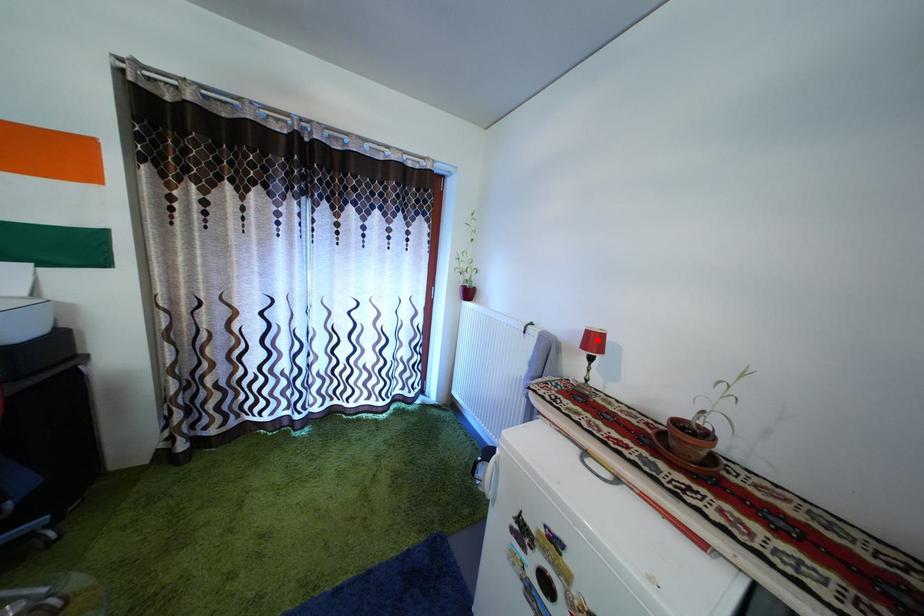
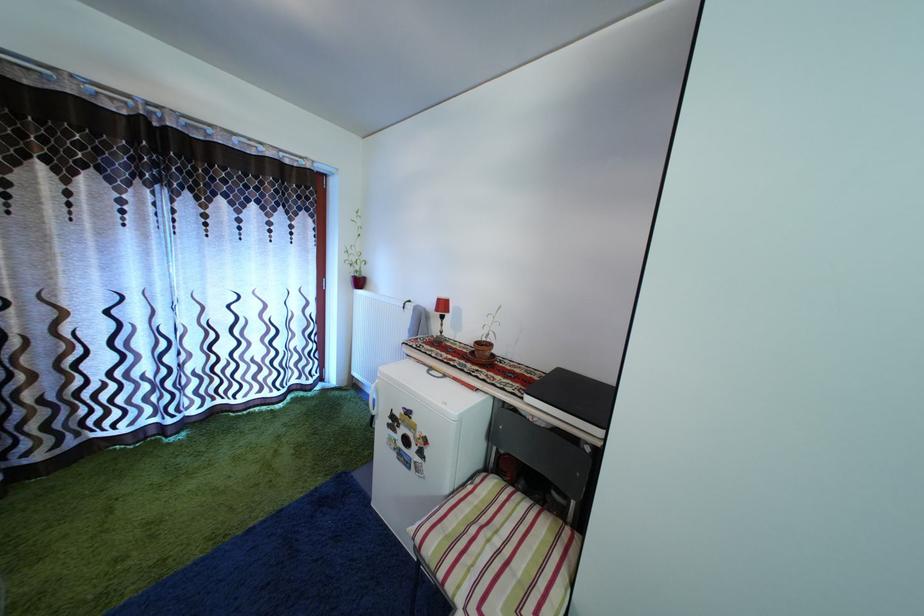
The point at the highlighted location is marked in the first image. Where is the corresponding point in the second image?

(446, 308)